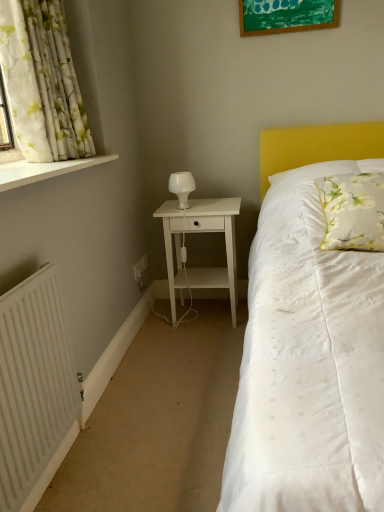
This screenshot has height=512, width=384. I want to click on vacant space behind white frosted glass table lamp at center, so click(x=198, y=200).